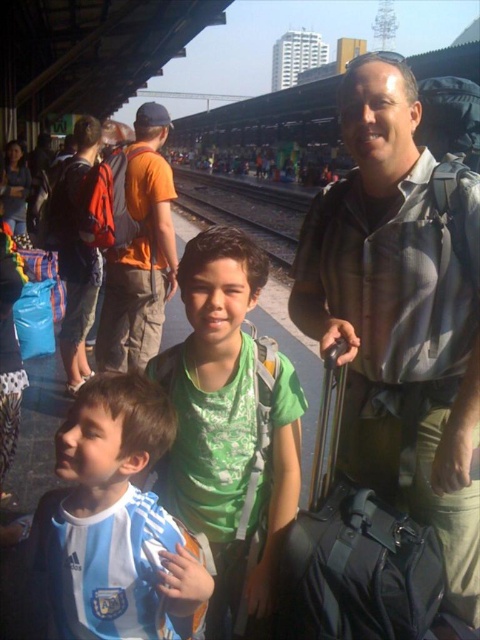
Is white jersey at lower left closer to camera compared to matte black backpack at left?

Yes, white jersey at lower left is in front of matte black backpack at left.

Which of these two, white jersey at lower left or matte black backpack at left, stands taller?

Standing taller between the two is matte black backpack at left.

Between point (106, 481) and point (74, 221), which one is positioned in front?

Point (106, 481) is in front.

Where is `white jersey at lower left`? This screenshot has width=480, height=640. white jersey at lower left is located at coordinates (115, 522).

Is point (148, 196) farther from viewer compared to point (60, 172)?

No, (148, 196) is in front of (60, 172).

Which is more to the left, orange fabric backpack at center or matte black backpack at left?

From the viewer's perspective, matte black backpack at left appears more on the left side.

I want to click on orange fabric backpack at center, so click(x=141, y=252).

Where is `orange fabric backpack at center`? orange fabric backpack at center is located at coordinates (141, 252).

Describe the element at coordinates (141, 252) in the screenshot. This screenshot has height=640, width=480. I see `orange fabric backpack at center` at that location.

Can you confirm if orange fabric backpack at center is positioned to the left of metal train track at center?

No, orange fabric backpack at center is not to the left of metal train track at center.

Is point (112, 348) positioned behind point (257, 202)?

No, (112, 348) is closer to viewer.

Image resolution: width=480 pixels, height=640 pixels. Identify the location of orange fabric backpack at center. (141, 252).